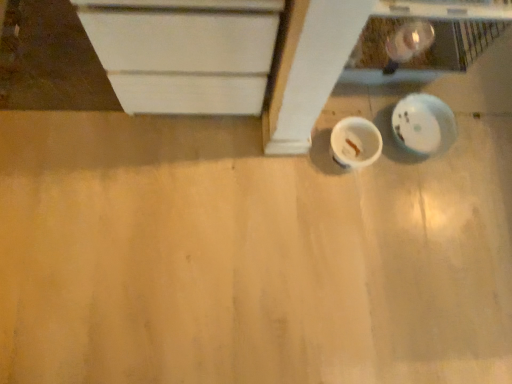
The image size is (512, 384). In order to click on vacant space in between white matte cup at center and white glossy plate at lower right in this screenshot , I will do `click(387, 139)`.